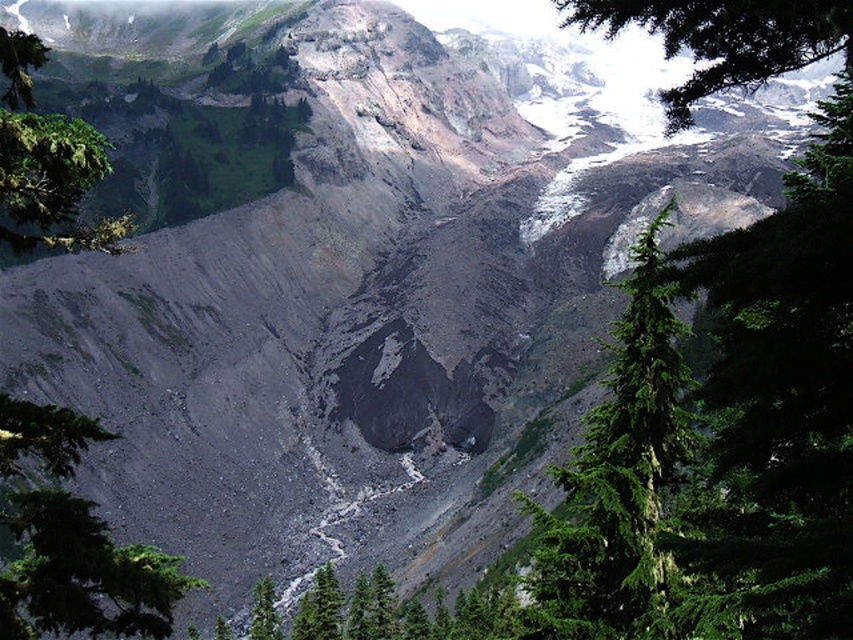
Based on the photo, you are an environmental scientist assessing the mountain ecosystem. You observe the green textured tree at center and the green leafy tree at upper left. Which tree would you expect to have a taller height based on their positions in the landscape?

The green textured tree at center is taller than the green leafy tree at upper left, so it would be the one with greater height.

You are a hiker standing at the point marked as point (619, 483). What can you see directly in front of you?

At point (619, 483) lies green textured tree at center, so you can see the green textured tree at center directly in front of you.

You are a photographer standing at the edge of a cliff overlooking the mountain landscape. You want to capture a photo that includes both the point at coordinates point [73,420] and point [67,225]. Which point should you focus on first to ensure both are in sharp focus?

You should focus on point [67,225] first because it is farther from the camera than point [73,420]. By focusing on the farther point, the closer point will also be within the depth of field, ensuring both are in sharp focus.